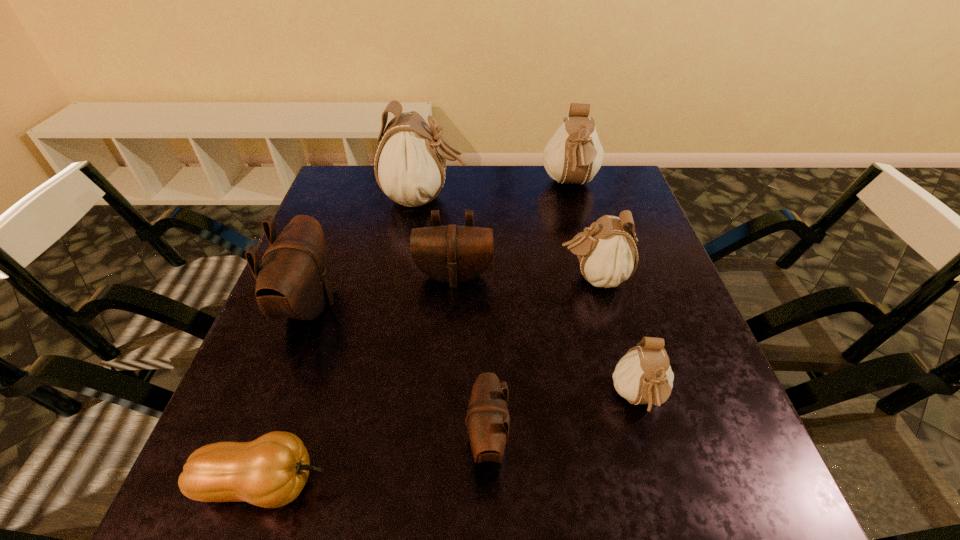
I want to click on vacant space at the right edge, so click(x=625, y=354).

Where is `free space at the far left corner of the desktop`? The image size is (960, 540). free space at the far left corner of the desktop is located at coordinates (365, 188).

You are a GUI agent. You are given a task and a screenshot of the screen. Output one action in this format:
    pyautogui.click(x=<x>, y=<y>)
    Task: Click on the free spot at the far right corner of the desktop
    The image size is (960, 540).
    Given the screenshot: What is the action you would take?
    pyautogui.click(x=616, y=197)

At what (x,y) coordinates should I click in order to perform the action: click on vacant space at the near right corner of the desktop. Please return your answer as a coordinate pair (x, y). The width and height of the screenshot is (960, 540). Looking at the image, I should click on (669, 476).

You are a GUI agent. You are given a task and a screenshot of the screen. Output one action in this format:
    pyautogui.click(x=<x>, y=<y>)
    Task: Click on the empty space that is in between the third smallest white pouch and the second smallest brown pouch
    The image size is (960, 540).
    Given the screenshot: What is the action you would take?
    pyautogui.click(x=513, y=230)

The image size is (960, 540). I want to click on free space between the third biggest white pouch and the leftmost white pouch, so click(x=509, y=238).

Locate an element on the screen. Image resolution: width=960 pixels, height=540 pixels. free space between the gourd and the second smallest white pouch is located at coordinates (428, 381).

Locate an element on the screen. vacant area that lies between the biggest white pouch and the nearest brown pouch is located at coordinates (456, 319).

Locate an element on the screen. The width and height of the screenshot is (960, 540). vacant area that lies between the nearest brown pouch and the nearest white pouch is located at coordinates (563, 419).

Find the location of `vacant region between the leftmost brown pouch and the gourd`. vacant region between the leftmost brown pouch and the gourd is located at coordinates (287, 394).